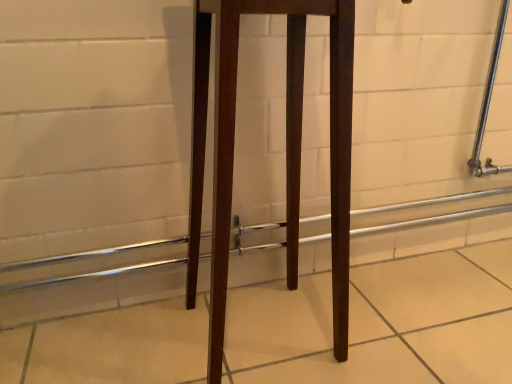
Describe the element at coordinates (286, 149) in the screenshot. I see `dark wood chair at center` at that location.

Where is `dark wood chair at center`? Image resolution: width=512 pixels, height=384 pixels. dark wood chair at center is located at coordinates (286, 149).

You are a GUI agent. You are given a task and a screenshot of the screen. Output one action in this format:
    pyautogui.click(x=<x>, y=<y>)
    Task: Click on the dark wood chair at center
    The height and width of the screenshot is (384, 512).
    Given the screenshot: What is the action you would take?
    pyautogui.click(x=286, y=149)